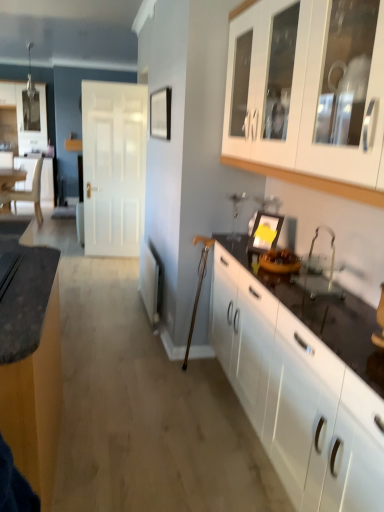
What is the approximate width of yellow paper at center?

It is 3.89 inches.

Measure the distance between light beige wood chair at left and camera.

light beige wood chair at left is 6.34 meters from camera.

You are a GUI agent. You are given a task and a screenshot of the screen. Output one action in this format:
    pyautogui.click(x=<x>, y=<y>)
    Task: Click on the white matte door at center
    
    Given the screenshot: What is the action you would take?
    pyautogui.click(x=113, y=166)

Describe the element at coordinates (301, 383) in the screenshot. I see `white glossy cabinets at right, which is the 2th cabinetry from right to left` at that location.

At what (x,y) coordinates should I click in order to perform the action: click on wooden table at left. Please return your answer as a coordinate pair (x, y). Image resolution: width=384 pixels, height=512 pixels. Looking at the image, I should click on (11, 176).

Is white glossy cabinet at upper right, the first cabinetry from the right, inside or outside of white matte door at center?

The correct answer is: outside.

Is white glossy cabinet at upper right, the first cabinetry from the right, in contact with white matte door at center?

No, white glossy cabinet at upper right, the first cabinetry from the right, is not making contact with white matte door at center.

Find the location of a particular element. The width and height of the screenshot is (384, 512). cabinetry that is the 1st object located below the white matte door at center (from the image's perspective) is located at coordinates (308, 101).

From a real-world perspective, is white glossy cabinet at upper right, marked as the 3th cabinetry in a left-to-right arrangement, physically located above or below white matte door at center?

In terms of real-world spatial position, white glossy cabinet at upper right, marked as the 3th cabinetry in a left-to-right arrangement, is above white matte door at center.

Looking at the image, does wooden table at left seem bigger or smaller compared to white matte door at center?

Considering their sizes, wooden table at left takes up less space than white matte door at center.

Which is more to the left, wooden table at left or white matte door at center?

wooden table at left is more to the left.

Is wooden table at left not inside white matte door at center?

Indeed, wooden table at left is completely outside white matte door at center.

From their relative heights in the image, would you say wooden table at left is taller or shorter than white matte door at center?

Clearly, wooden table at left is shorter compared to white matte door at center.

What's the angular difference between white glossy cabinet at upper right, marked as the 3th cabinetry in a left-to-right arrangement, and yellow paper at center's facing directions?

The facing directions of white glossy cabinet at upper right, marked as the 3th cabinetry in a left-to-right arrangement, and yellow paper at center are 33.6 degrees apart.

Is white glossy cabinet at upper right, marked as the 3th cabinetry in a left-to-right arrangement, spatially inside yellow paper at center, or outside of it?

white glossy cabinet at upper right, marked as the 3th cabinetry in a left-to-right arrangement, exists outside the volume of yellow paper at center.

Which object is further away from the camera taking this photo, white glossy cabinet at upper right, the first cabinetry from the right, or yellow paper at center?

yellow paper at center is further from the camera.

From a real-world perspective, who is located higher, white glossy cabinet at upper right, marked as the 3th cabinetry in a left-to-right arrangement, or yellow paper at center?

From a 3D spatial view, white glossy cabinet at upper right, marked as the 3th cabinetry in a left-to-right arrangement, is above.

Is clear glass sink at lower right inside the boundaries of white matte door at center, or outside?

clear glass sink at lower right is not enclosed by white matte door at center.

Measure the distance between clear glass sink at lower right and white matte door at center.

3.28 meters.

From a real-world perspective, is clear glass sink at lower right over white matte door at center?

Yes, from a real-world perspective, clear glass sink at lower right is on top of white matte door at center.

Looking at this image, is clear glass sink at lower right not near white matte door at center?

That's right, there is a large distance between clear glass sink at lower right and white matte door at center.

Is white glossy cabinets at right, which is the 2th cabinetry from right to left, outside of white matte door at center?

Yes, white glossy cabinets at right, which is the 2th cabinetry from right to left, is not within white matte door at center.

Is white matte door at center at the back of white glossy cabinets at right, the 2th cabinetry viewed from the left?

white glossy cabinets at right, the 2th cabinetry viewed from the left, does not have its back to white matte door at center.

Would you say matte black countertop at left, which is the 3th cabinetry from right to left, is outside white glossy cabinet at upper right, the first cabinetry from the right?

Yes, matte black countertop at left, which is the 3th cabinetry from right to left, is outside of white glossy cabinet at upper right, the first cabinetry from the right.

Is matte black countertop at left, which is the 3th cabinetry from right to left, facing towards white glossy cabinet at upper right, marked as the 3th cabinetry in a left-to-right arrangement?

No, matte black countertop at left, which is the 3th cabinetry from right to left, is not turned towards white glossy cabinet at upper right, marked as the 3th cabinetry in a left-to-right arrangement.

Are matte black countertop at left, which appears as the first cabinetry when viewed from the left, and white glossy cabinet at upper right, marked as the 3th cabinetry in a left-to-right arrangement, far apart?

Absolutely, matte black countertop at left, which appears as the first cabinetry when viewed from the left, is distant from white glossy cabinet at upper right, marked as the 3th cabinetry in a left-to-right arrangement.

Does point (28, 265) come closer to viewer compared to point (232, 97)?

Yes, it is in front of point (232, 97).

Considering the relative positions of white matte door at center and white glossy cabinet at upper right, marked as the 3th cabinetry in a left-to-right arrangement, in the image provided, is white matte door at center to the left or to the right of white glossy cabinet at upper right, marked as the 3th cabinetry in a left-to-right arrangement,?

From the image, it's evident that white matte door at center is to the left of white glossy cabinet at upper right, marked as the 3th cabinetry in a left-to-right arrangement.

From the image's perspective, which is above, white matte door at center or white glossy cabinet at upper right, the first cabinetry from the right?

white matte door at center is shown above in the image.

Are white matte door at center and white glossy cabinet at upper right, the first cabinetry from the right, far apart?

Absolutely, white matte door at center is distant from white glossy cabinet at upper right, the first cabinetry from the right.

What's the angular difference between white matte door at center and white glossy cabinet at upper right, the first cabinetry from the right,'s facing directions?

81.8 degrees separate the facing orientations of white matte door at center and white glossy cabinet at upper right, the first cabinetry from the right.

What are the coordinates of `the 3rd cabinetry in front of the white matte door at center, starting your count from the anchor` in the screenshot? It's located at (308, 101).

Locate an element on the screen. table behind the white matte door at center is located at coordinates (11, 176).

When comparing their distances from matte black countertop at left, which appears as the first cabinetry when viewed from the left, does clear glass sink at lower right or wooden table at left seem further?

wooden table at left is further to matte black countertop at left, which appears as the first cabinetry when viewed from the left.

Estimate the real-world distances between objects in this image. Which object is further from yellow paper at center, wooden table at left or white matte door at center?

The object further to yellow paper at center is wooden table at left.

Looking at the image, which one is located closer to white glossy cabinets at right, the 2th cabinetry viewed from the left, yellow paper at center or white glossy cabinet at upper right, the first cabinetry from the right?

yellow paper at center.

Considering their positions, is clear glass sink at lower right positioned further to white matte door at center than white glossy cabinet at upper right, the first cabinetry from the right?

Based on the image, clear glass sink at lower right appears to be further to white matte door at center.

When comparing their distances from clear glass sink at lower right, does white glossy cabinet at upper right, the first cabinetry from the right, or yellow paper at center seem further?

white glossy cabinet at upper right, the first cabinetry from the right, is further to clear glass sink at lower right.

Based on their spatial positions, is clear glass sink at lower right or matte black countertop at left, which appears as the first cabinetry when viewed from the left, further from white glossy cabinet at upper right, the first cabinetry from the right?

Based on the image, matte black countertop at left, which appears as the first cabinetry when viewed from the left, appears to be further to white glossy cabinet at upper right, the first cabinetry from the right.

From the picture: Looking at the image, which one is located closer to wooden table at left, clear glass sink at lower right or light beige wood chair at left?

The object closer to wooden table at left is light beige wood chair at left.

From the image, which object appears to be farther from white matte door at center, white glossy cabinet at upper right, the first cabinetry from the right, or yellow paper at center?

white glossy cabinet at upper right, the first cabinetry from the right.

At what (x,y) coordinates should I click in order to perform the action: click on chair between white glossy cabinets at right, which is the 2th cabinetry from right to left, and wooden table at left from front to back. Please return your answer as a coordinate pair (x, y). Looking at the image, I should click on (30, 192).

Find the location of a particular element. Image resolution: width=384 pixels, height=512 pixels. door between yellow paper at center and light beige wood chair at left in the front-back direction is located at coordinates (113, 166).

Locate an element on the screen. This screenshot has width=384, height=512. sink between white glossy cabinet at upper right, the first cabinetry from the right, and yellow paper at center in the front-back direction is located at coordinates (319, 271).

Where is `chair between white glossy cabinet at upper right, marked as the 3th cabinetry in a left-to-right arrangement, and wooden table at left, along the z-axis`? This screenshot has width=384, height=512. chair between white glossy cabinet at upper right, marked as the 3th cabinetry in a left-to-right arrangement, and wooden table at left, along the z-axis is located at coordinates (30, 192).